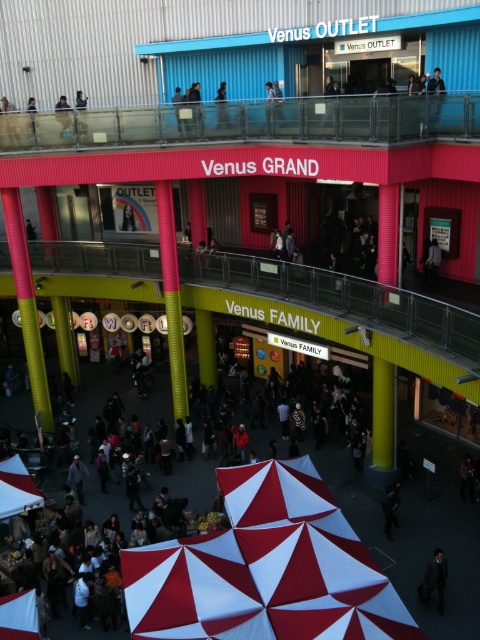
You are a customer at the Venus GRAND shopping center. You see a red and white fabric canopy at center and a dark gray suit at lower right. Which object is larger in size?

The dark gray suit at lower right is larger than the red and white fabric canopy at center.

You are a customer looking for a shaded area to rest. You see the red and white fabric canopy at center and the dark gray suit at lower right. Which object is closer to the left side of the shopping center?

The red and white fabric canopy at center is to the left of the dark gray suit at lower right, so it is closer to the left side of the shopping center.